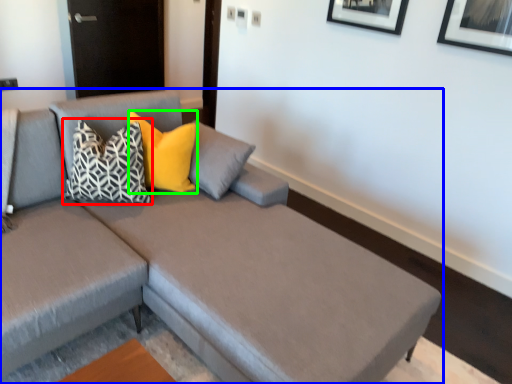
Question: Which object is the farthest from pillow (highlighted by a red box)? Choose among these: studio couch (highlighted by a blue box) or pillow (highlighted by a green box).

Choices:
 (A) studio couch
 (B) pillow

Answer: (A)